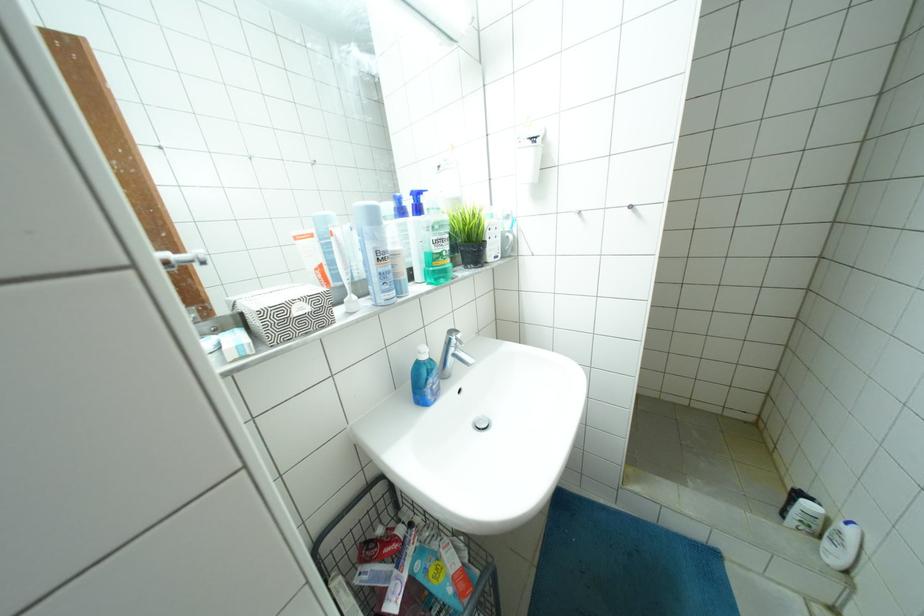
Describe the element at coordinates (455, 338) in the screenshot. I see `the faucet handle` at that location.